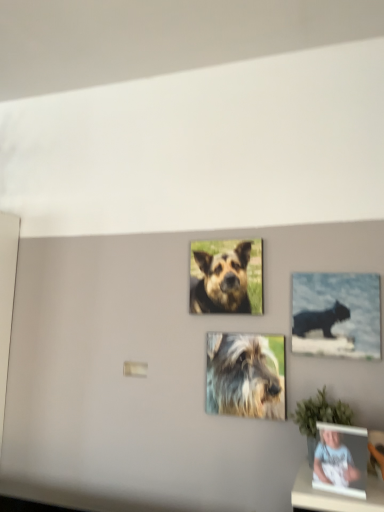
Question: From a real-world perspective, is fuzzy fur dog at center, the second dog positioned from the top, on top of brown fur dog at center, which is counted as the 1th dog, starting from the top?

Choices:
 (A) yes
 (B) no

Answer: (B)

Question: Is fuzzy fur dog at center, the second dog positioned from the top, completely or partially outside of brown fur dog at center, which is counted as the 1th dog, starting from the top?

Choices:
 (A) no
 (B) yes

Answer: (B)

Question: Considering the relative sizes of fuzzy fur dog at center, the second dog positioned from the top, and brown fur dog at center, which is the second dog from bottom to top, in the image provided, is fuzzy fur dog at center, the second dog positioned from the top, thinner than brown fur dog at center, which is the second dog from bottom to top,?

Choices:
 (A) no
 (B) yes

Answer: (B)

Question: Can brown fur dog at center, which is the second dog from bottom to top, be found inside fuzzy fur dog at center, the 1th dog when ordered from bottom to top?

Choices:
 (A) yes
 (B) no

Answer: (B)

Question: Is fuzzy fur dog at center, the second dog positioned from the top, not near brown fur dog at center, which is counted as the 1th dog, starting from the top?

Choices:
 (A) yes
 (B) no

Answer: (B)

Question: Is fuzzy fur dog at center, the 1th dog when ordered from bottom to top, to the right of brown fur dog at center, which is counted as the 1th dog, starting from the top, from the viewer's perspective?

Choices:
 (A) yes
 (B) no

Answer: (A)

Question: Is the surface of black glossy cat at upper right in direct contact with matte black photo frame at lower right?

Choices:
 (A) yes
 (B) no

Answer: (B)

Question: Does black glossy cat at upper right have a greater height compared to matte black photo frame at lower right?

Choices:
 (A) yes
 (B) no

Answer: (A)

Question: From a real-world perspective, is black glossy cat at upper right on matte black photo frame at lower right?

Choices:
 (A) yes
 (B) no

Answer: (A)

Question: Considering the relative sizes of black glossy cat at upper right and matte black photo frame at lower right in the image provided, is black glossy cat at upper right thinner than matte black photo frame at lower right?

Choices:
 (A) no
 (B) yes

Answer: (B)

Question: From the image's perspective, is black glossy cat at upper right above matte black photo frame at lower right?

Choices:
 (A) no
 (B) yes

Answer: (B)

Question: Could you tell me if black glossy cat at upper right is turned towards matte black photo frame at lower right?

Choices:
 (A) yes
 (B) no

Answer: (B)

Question: From the image's perspective, is matte black photo frame at lower right below fuzzy fur dog at center, the 1th dog when ordered from bottom to top?

Choices:
 (A) no
 (B) yes

Answer: (B)